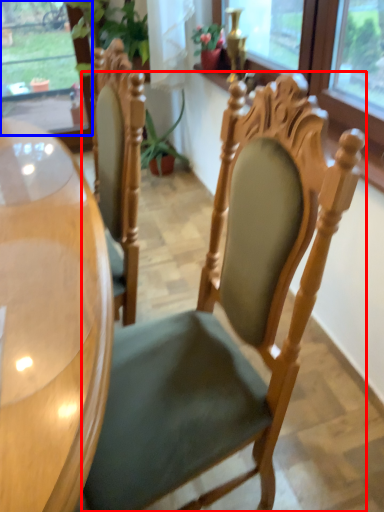
Question: Which object appears farthest to the camera in this image, chair (highlighted by a red box) or window (highlighted by a blue box)?

Choices:
 (A) chair
 (B) window

Answer: (B)